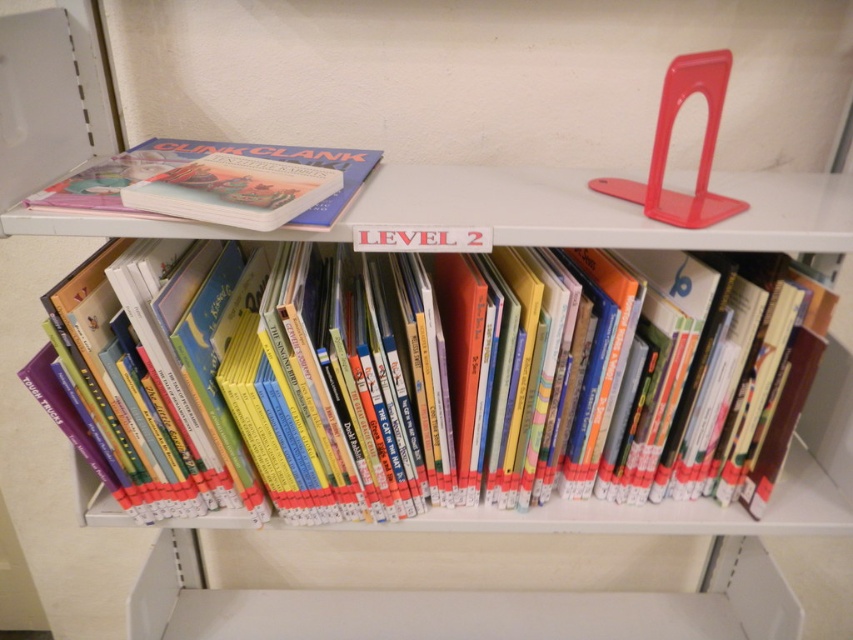
Who is higher up, hardcover books at center or matte hardcover book at upper left?

matte hardcover book at upper left is above.

Can you confirm if hardcover books at center is taller than matte hardcover book at upper left?

Yes.

Is point (160, 419) positioned behind point (131, 170)?

No, it is not.

Locate an element on the screen. The image size is (853, 640). hardcover books at center is located at coordinates 416,385.